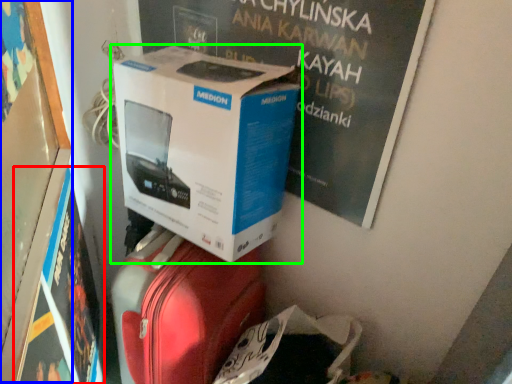
Question: Which is farther away from magazine (highlighted by a red box)? bulletin board (highlighted by a blue box) or box (highlighted by a green box)?

Choices:
 (A) bulletin board
 (B) box

Answer: (B)